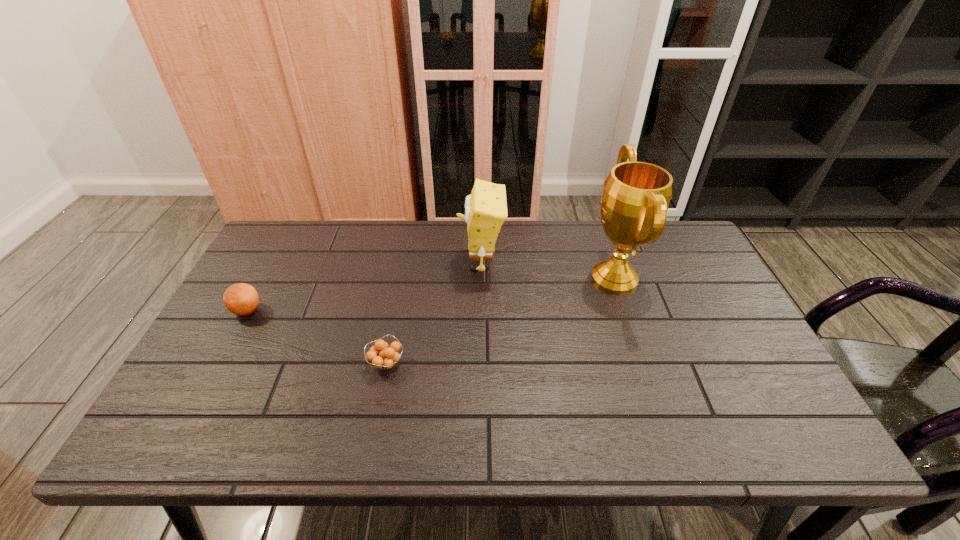
Locate an element on the screen. free space between the award and the nearer orange fruit is located at coordinates (500, 321).

You are a GUI agent. You are given a task and a screenshot of the screen. Output one action in this format:
    pyautogui.click(x=<x>, y=<y>)
    Task: Click on the vacant space that is in between the third object from left to right and the tallest object
    This screenshot has width=960, height=540.
    Given the screenshot: What is the action you would take?
    pos(548,270)

Find the location of a particular element. The image size is (960, 540). vacant space in between the shorter orange fruit and the sponge is located at coordinates (434, 313).

The image size is (960, 540). In order to click on vacant area that lies between the nearest object and the award in this screenshot , I will do `click(500, 321)`.

I want to click on object that stands as the closest to the second tallest object, so click(636, 197).

The height and width of the screenshot is (540, 960). I want to click on the third closest object to the sponge, so click(x=241, y=299).

Locate an element on the screen. Image resolution: width=960 pixels, height=540 pixels. vacant space that satisfies the following two spatial constraints: 1. on the front-facing side of the tallest object; 2. on the front side of the leftmost object is located at coordinates coord(626,310).

This screenshot has width=960, height=540. What are the coordinates of `vacant space that satisfies the following two spatial constraints: 1. on the face of the sponge; 2. on the front side of the second shortest object` in the screenshot? It's located at (481, 310).

The image size is (960, 540). Find the location of `vacant space that satisfies the following two spatial constraints: 1. on the face of the third shortest object; 2. on the front side of the nearest object`. vacant space that satisfies the following two spatial constraints: 1. on the face of the third shortest object; 2. on the front side of the nearest object is located at coordinates click(482, 363).